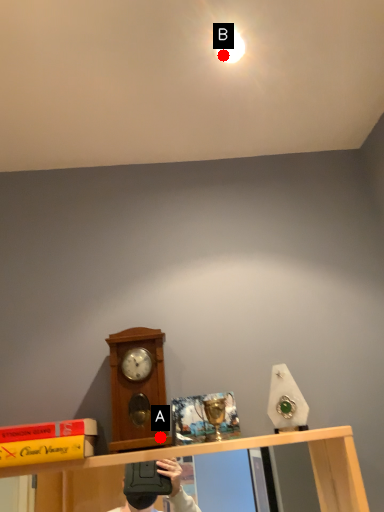
Question: Two points are circled on the image, labeled by A and B beside each circle. Among these points, which one is farthest from the camera?

Choices:
 (A) A is further
 (B) B is further

Answer: (B)